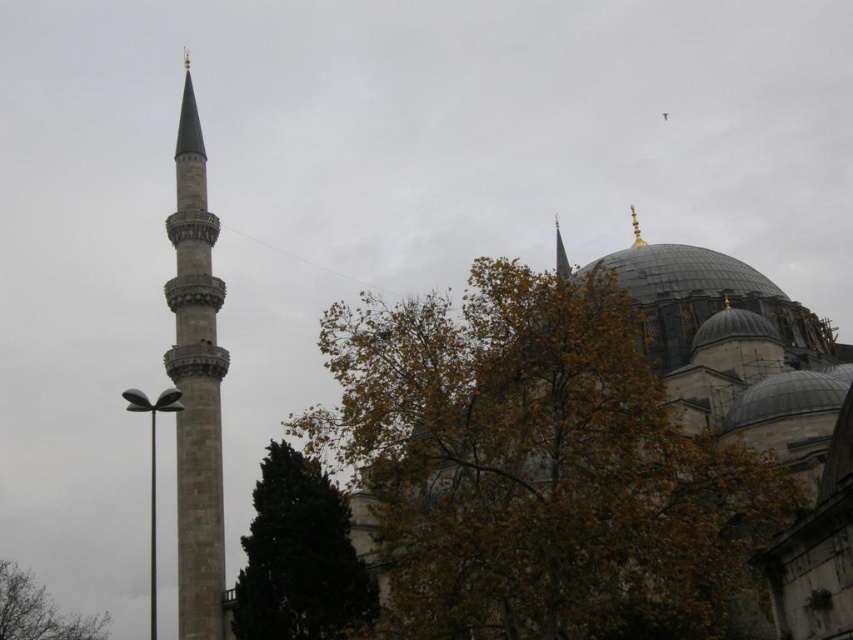
You are standing in the courtyard of the mosque and notice a point marked at coordinates (196, 384). Based on the scene description, what architectural feature does this point most likely correspond to?

The point at (196, 384) corresponds to the gray stone minaret at left, as indicated by the Objects Description.

You are standing at the camera position and want to take a photo of the gray stone minaret at left. Considering the distance, can you estimate how far you are from the minaret?

The gray stone minaret at left is 95.25 meters away from camera, so you are approximately 95.25 meters away from the minaret.